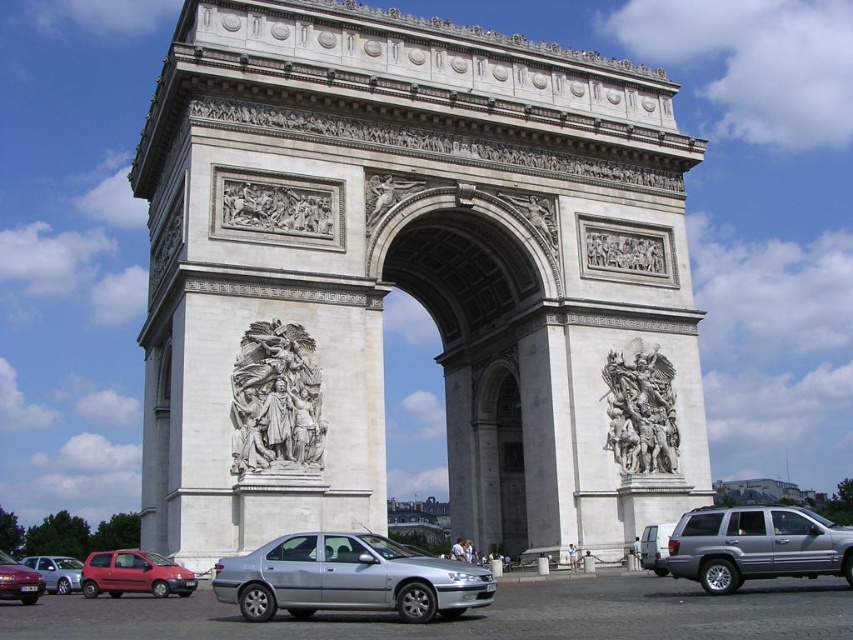
Between point (753, 506) and point (97, 556), which one is positioned behind?

The point (97, 556) is behind.

Which is below, silver metallic suv at right or matte red hatchback at lower left?

Positioned lower is matte red hatchback at lower left.

Describe the element at coordinates (756, 545) in the screenshot. I see `silver metallic suv at right` at that location.

At what (x,y) coordinates should I click in order to perform the action: click on silver metallic suv at right. Please return your answer as a coordinate pair (x, y). Image resolution: width=853 pixels, height=640 pixels. Looking at the image, I should click on (756, 545).

I want to click on matte red car at lower left, so click(18, 580).

This screenshot has width=853, height=640. I want to click on matte red car at lower left, so click(18, 580).

Is matte red car at lower left below silver metallic sedan at lower left?

No, matte red car at lower left is not below silver metallic sedan at lower left.

Which is in front, point (16, 595) or point (80, 568)?

Point (16, 595)

Locate an element on the screen. matte red car at lower left is located at coordinates (18, 580).

Where is `matte red car at lower left`? matte red car at lower left is located at coordinates (18, 580).